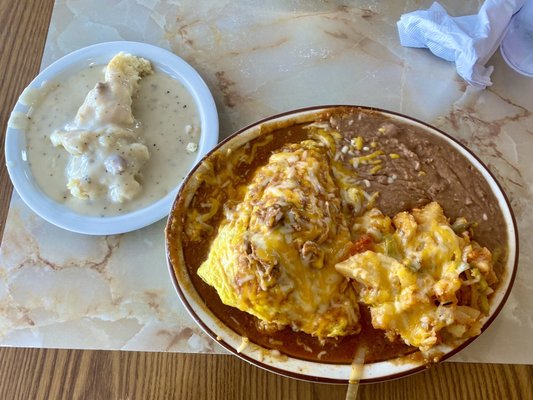
The image size is (533, 400). Identify the location of bowl. (185, 82).